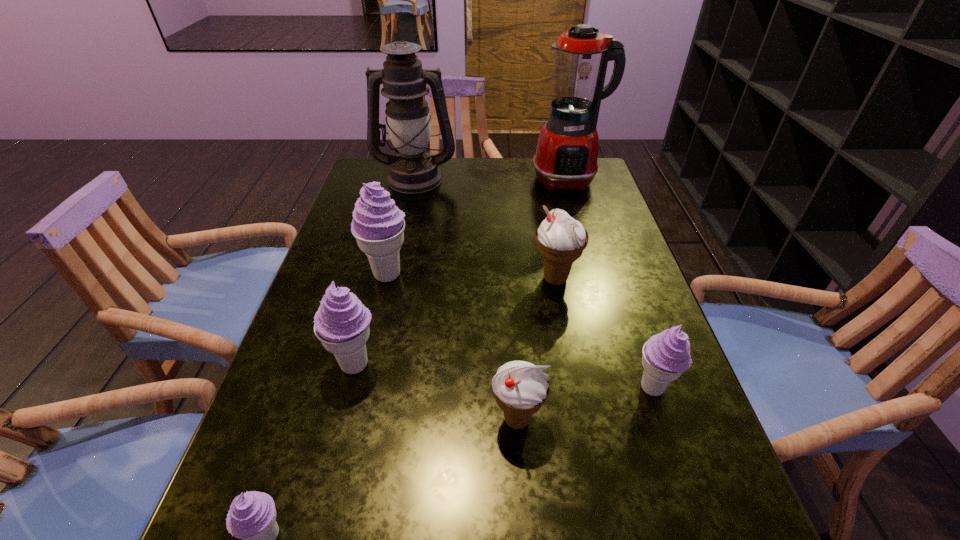
Find the location of `the third closest purple icecream relative to the tallest icecream`. the third closest purple icecream relative to the tallest icecream is located at coordinates (666, 356).

Choose which white icecream is the nearest neighbor to the nearest purple icecream. Please provide its 2D coordinates. Your answer should be formatted as a tuple, i.e. [(x, y)], where the tuple contains the x and y coordinates of a point satisfying the conditions above.

[(520, 388)]

This screenshot has width=960, height=540. Identify the location of white icecream that stands as the closest to the third biggest purple icecream. [520, 388].

What are the coordinates of `vacant space that satisfies the following two spatial constraints: 1. on the back side of the blue oil lamp; 2. on the right side of the second biggest purple icecream` in the screenshot? It's located at (403, 178).